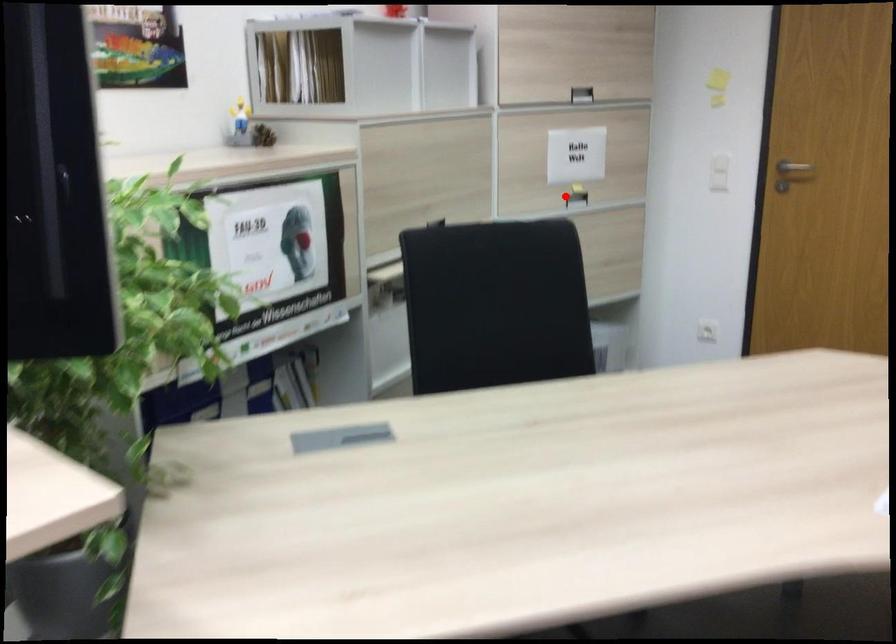
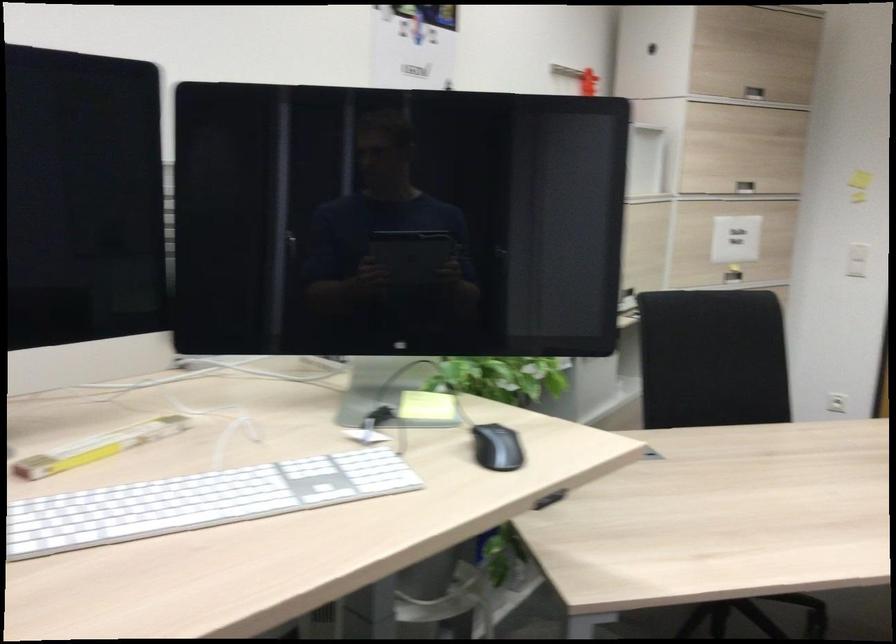
Question: I am providing you with two images of the same scene from different viewpoints. A red point is shown in image1. For the corresponding object point in image2, is it positioned nearer or farther from the camera?

Choices:
 (A) Nearer
 (B) Farther

Answer: (B)